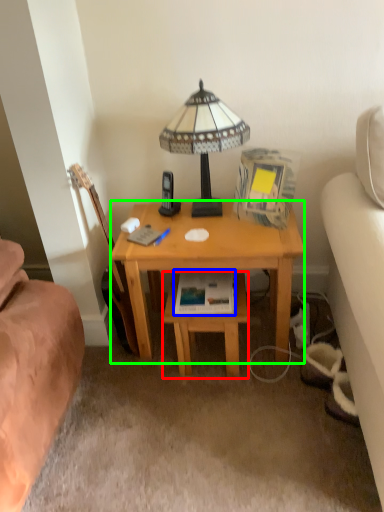
Question: Considering the real-world distances, which object is closest to table (highlighted by a red box)? paperback book (highlighted by a blue box) or desk (highlighted by a green box).

Choices:
 (A) paperback book
 (B) desk

Answer: (A)